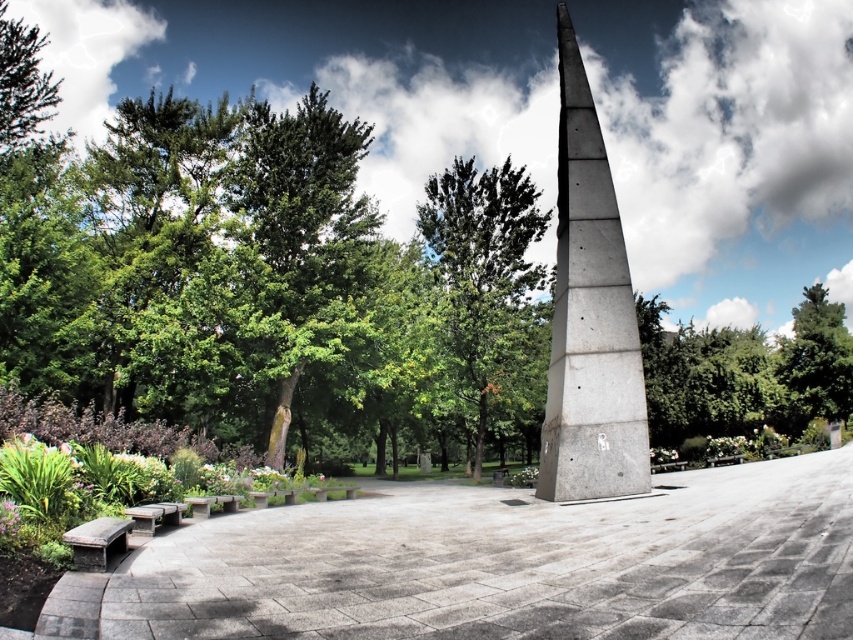
Which is above, gray concrete bench at lower left or green leafy tree at upper right?

Positioned higher is green leafy tree at upper right.

Which is below, gray concrete bench at lower left or green leafy tree at upper right?

gray concrete bench at lower left is lower down.

Does point (184, 573) come closer to viewer compared to point (810, 288)?

Yes, it is.

Find the location of a particular element. gray concrete bench at lower left is located at coordinates (497, 564).

In order to click on gray concrete bench at lower left in this screenshot , I will do `click(497, 564)`.

Can you confirm if gray concrete bench at lower left is positioned below wooden bench at lower left?

Yes, gray concrete bench at lower left is below wooden bench at lower left.

Where is `gray concrete bench at lower left`? The height and width of the screenshot is (640, 853). gray concrete bench at lower left is located at coordinates (497, 564).

Image resolution: width=853 pixels, height=640 pixels. Find the location of `gray concrete bench at lower left`. gray concrete bench at lower left is located at coordinates (497, 564).

Image resolution: width=853 pixels, height=640 pixels. I want to click on gray concrete bench at lower left, so click(x=497, y=564).

Can you confirm if gray concrete bench at lower left is positioned to the right of concrete gray obelisk at center?

No, gray concrete bench at lower left is not to the right of concrete gray obelisk at center.

Where is `gray concrete bench at lower left`? Image resolution: width=853 pixels, height=640 pixels. gray concrete bench at lower left is located at coordinates (497, 564).